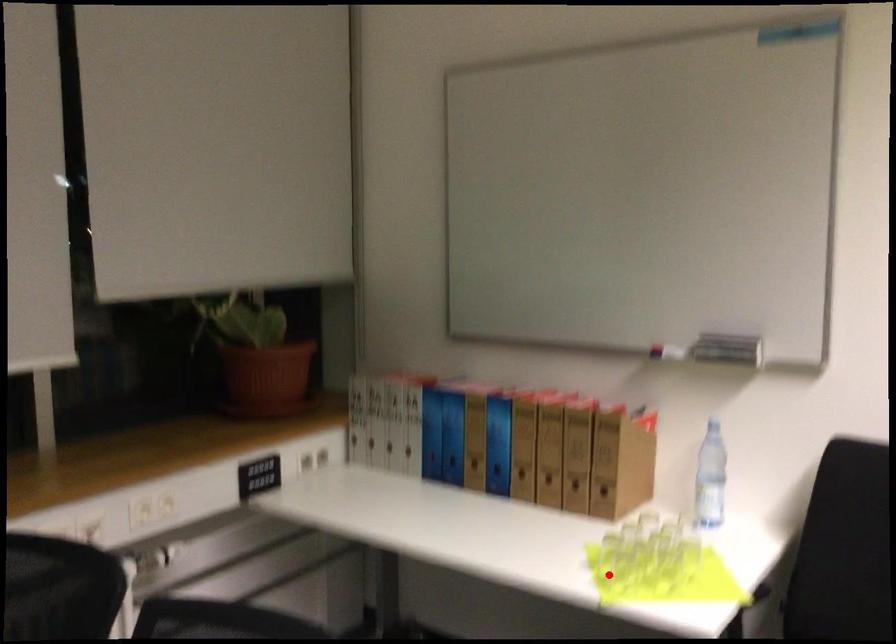
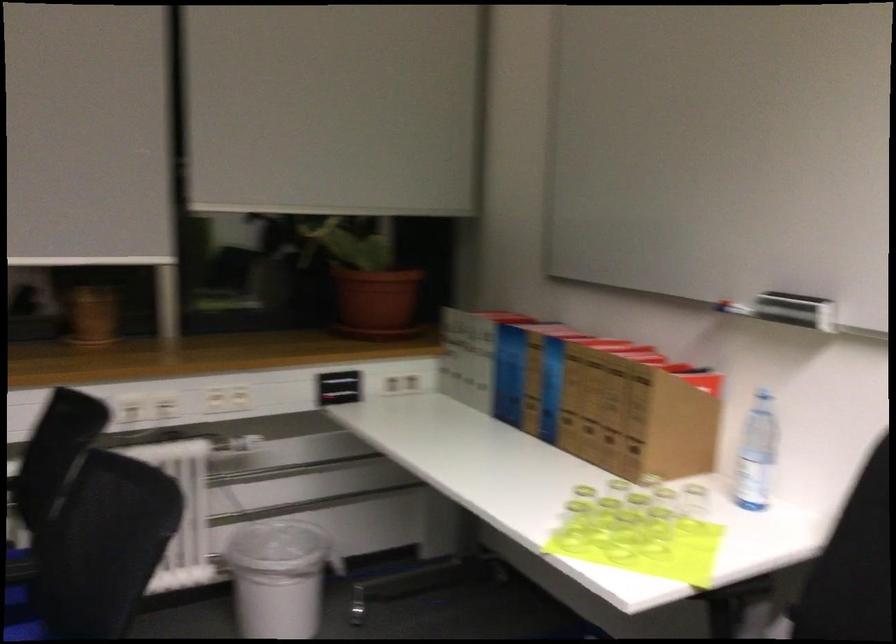
Locate, in the second image, the point that corresponds to the highlighted location in the first image.

(573, 526)